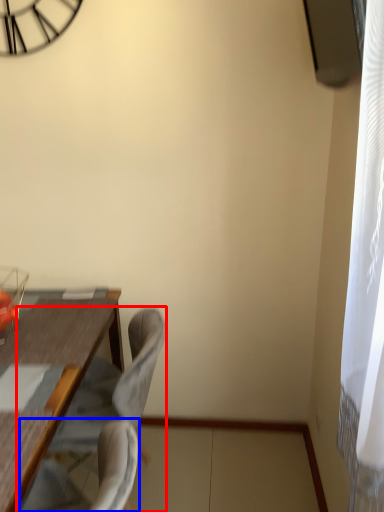
Question: Which object appears farthest to the camera in this image, chair (highlighted by a red box) or swivel chair (highlighted by a blue box)?

Choices:
 (A) chair
 (B) swivel chair

Answer: (A)